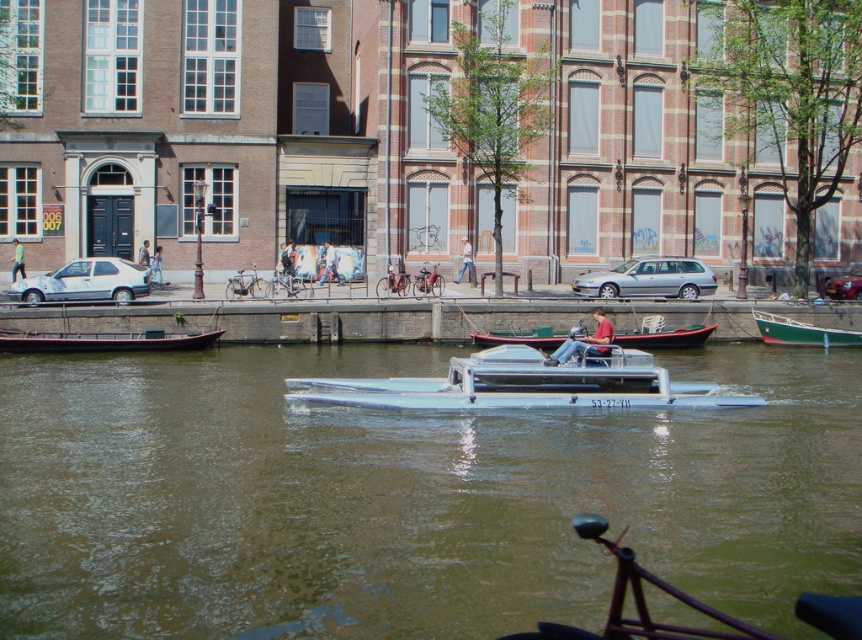
Question: Among these points, which one is farthest from the camera?

Choices:
 (A) (80, 284)
 (B) (673, 282)

Answer: (B)

Question: Which point is farther to the camera?

Choices:
 (A) (615, 289)
 (B) (851, 298)

Answer: (B)

Question: Is brown water at center to the right of wooden boat at center from the viewer's perspective?

Choices:
 (A) no
 (B) yes

Answer: (A)

Question: Can you confirm if brown water at center is smaller than white matte car at left?

Choices:
 (A) no
 (B) yes

Answer: (A)

Question: Which point is closer to the camera taking this photo?

Choices:
 (A) (142, 339)
 (B) (629, 333)

Answer: (A)

Question: Can you confirm if brown water at center is wider than green polished wood boat at lower right?

Choices:
 (A) no
 (B) yes

Answer: (B)